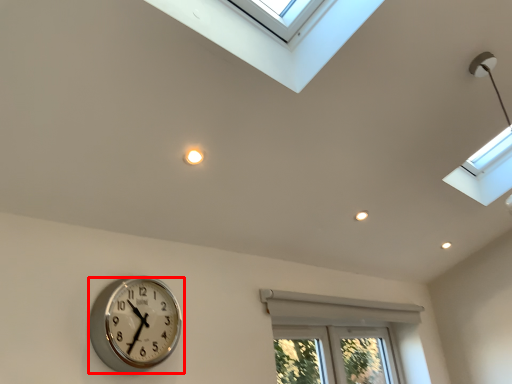
Question: Considering the relative positions of wall clock (annotated by the red box) and bay window in the image provided, where is wall clock (annotated by the red box) located with respect to the staircase?

Choices:
 (A) right
 (B) left

Answer: (B)